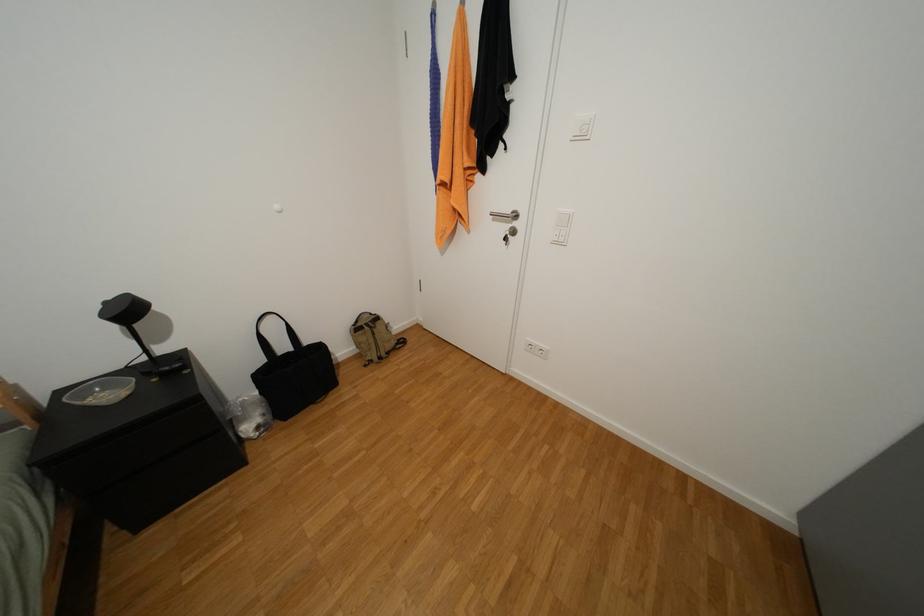
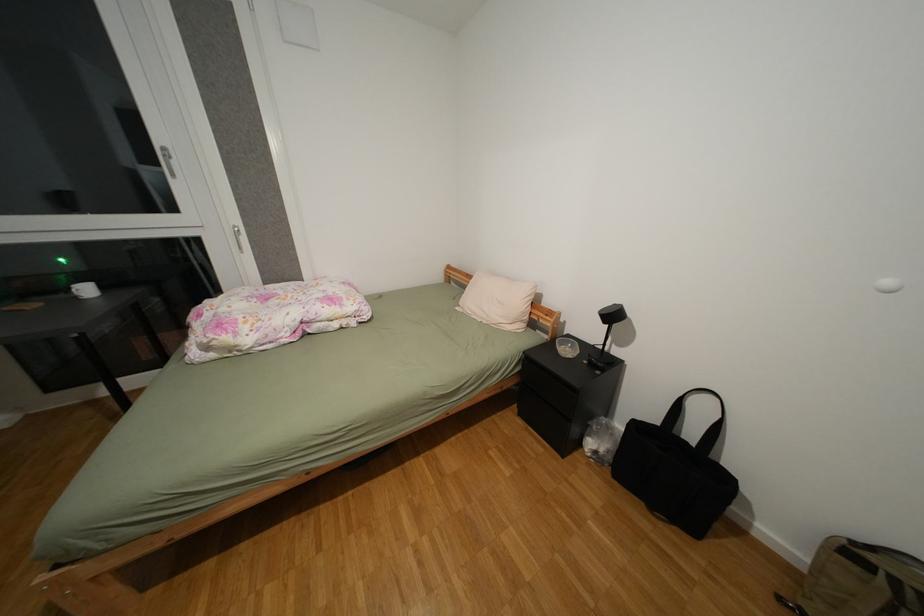
The first image is from the beginning of the video and the second image is from the end. How did the camera likely rotate when shooting the video?

The rotation direction of the camera is left-down.